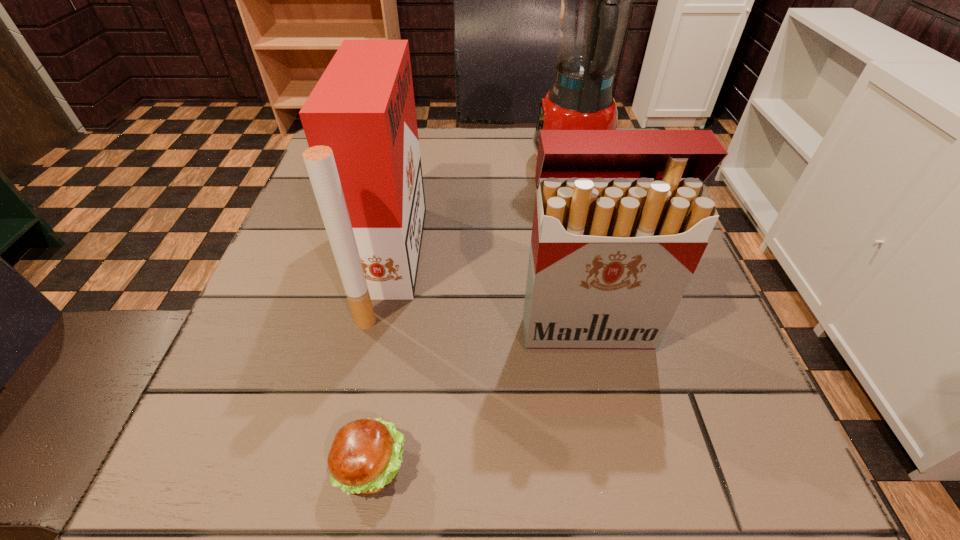
Where is `food processor`? The width and height of the screenshot is (960, 540). food processor is located at coordinates (596, 0).

Find the location of a particular element. the farthest object is located at coordinates (596, 0).

Find the location of `the left cigarette case`. the left cigarette case is located at coordinates click(x=363, y=161).

This screenshot has width=960, height=540. I want to click on the right cigarette case, so click(x=622, y=218).

I want to click on hamburger, so click(x=364, y=458).

In order to click on the nearest object in this screenshot , I will do `click(364, 458)`.

Locate an element on the screen. The width and height of the screenshot is (960, 540). free space located on the controls of the food processor is located at coordinates (461, 168).

At what (x,y) coordinates should I click in order to perform the action: click on vacant area situated 0.170m on the controls of the food processor. Please return your answer as a coordinate pair (x, y). The height and width of the screenshot is (540, 960). Looking at the image, I should click on (456, 168).

Where is `vacant position located 0.300m on the controls of the food processor`? vacant position located 0.300m on the controls of the food processor is located at coordinates (398, 168).

Locate an element on the screen. The image size is (960, 540). free location located on the front-facing side of the left cigarette case is located at coordinates (497, 262).